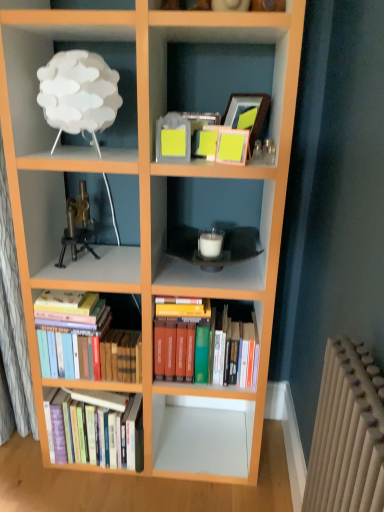
Question: Is hardcover books at lower left, the first book positioned from the left, spatially inside brass/bronze tripod at center-left, or outside of it?

Choices:
 (A) inside
 (B) outside

Answer: (B)

Question: Considering the positions of hardcover books at lower left, the first book positioned from the left, and brass/bronze tripod at center-left in the image, is hardcover books at lower left, the first book positioned from the left, taller or shorter than brass/bronze tripod at center-left?

Choices:
 (A) short
 (B) tall

Answer: (B)

Question: Which of these objects is positioned closest to the hardcover books at center, the first book viewed from the right?

Choices:
 (A) white matte lamp at upper left
 (B) hardcover books at lower left, the first book positioned from the left
 (C) brass/bronze tripod at center-left
 (D) hardcover books at lower left, arranged as the 2th book when viewed from the left

Answer: (D)

Question: Estimate the real-world distances between objects in this image. Which object is closer to the hardcover books at lower left, arranged as the 2th book when viewed from the left?

Choices:
 (A) hardcover books at center, the third book positioned from the left
 (B) hardcover books at lower left, the first book positioned from the left
 (C) brass/bronze tripod at center-left
 (D) white matte lamp at upper left

Answer: (B)